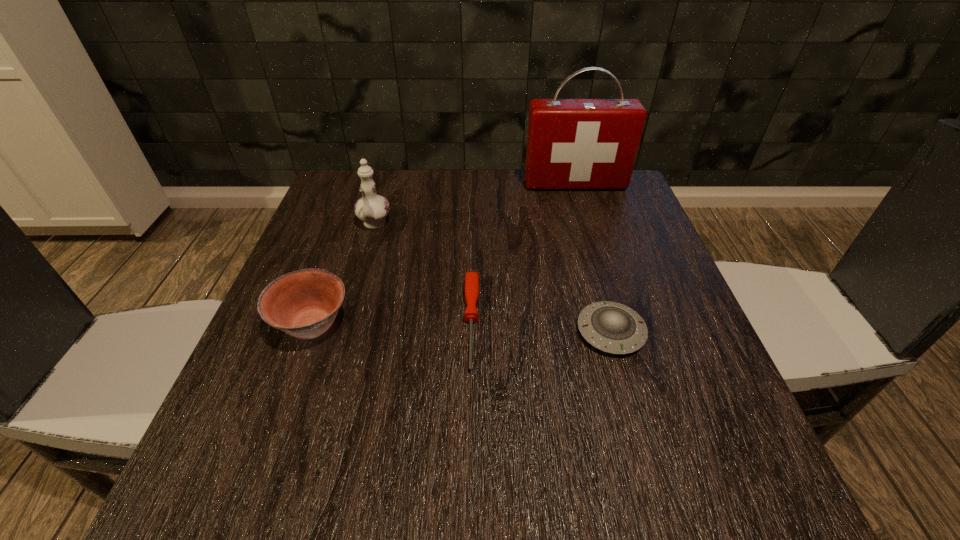
This screenshot has width=960, height=540. Identify the location of free spot that satisfies the following two spatial constraints: 1. at the spout of the second tallest object; 2. on the left side of the fourth tallest object. (343, 332).

Locate an element on the screen. free point that satisfies the following two spatial constraints: 1. at the tip of the saucer; 2. on the right side of the third object from left to right is located at coordinates (471, 332).